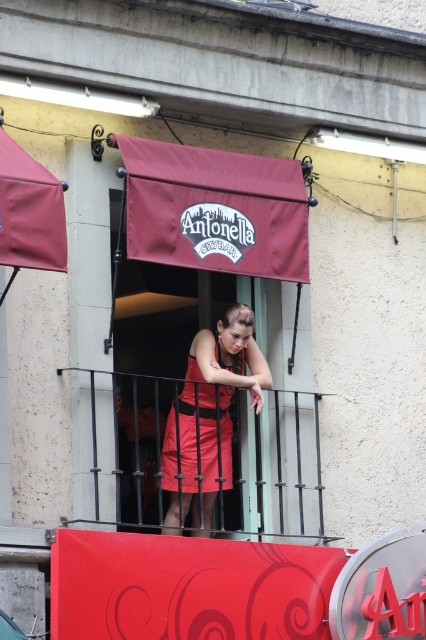
Question: Which point appears closest to the camera in this image?

Choices:
 (A) (229, 420)
 (B) (236, 497)
 (C) (169, 513)

Answer: (A)

Question: From the image, what is the correct spatial relationship of matte red dress at center in relation to satin red dress at center?

Choices:
 (A) above
 (B) below

Answer: (A)

Question: Estimate the real-world distances between objects in this image. Which object is closer to the black metal railing at center?

Choices:
 (A) matte red dress at center
 (B) satin red dress at center

Answer: (B)

Question: Among these points, which one is nearest to the camera?

Choices:
 (A) (118, 449)
 (B) (189, 428)

Answer: (B)

Question: Can you confirm if black metal railing at center is positioned below satin red dress at center?

Choices:
 (A) no
 (B) yes

Answer: (B)

Question: Does matte red dress at center appear on the right side of satin red dress at center?

Choices:
 (A) yes
 (B) no

Answer: (A)